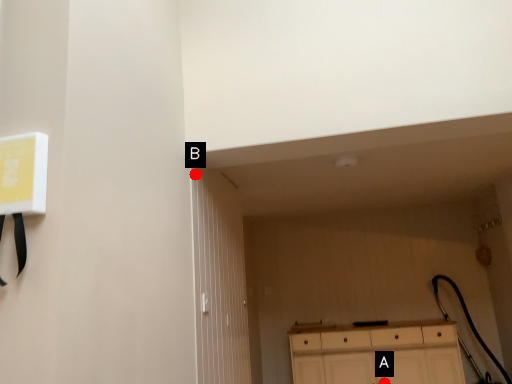
Question: Two points are circled on the image, labeled by A and B beside each circle. Which of the following is the closest to the observer?

Choices:
 (A) A is closer
 (B) B is closer

Answer: (B)